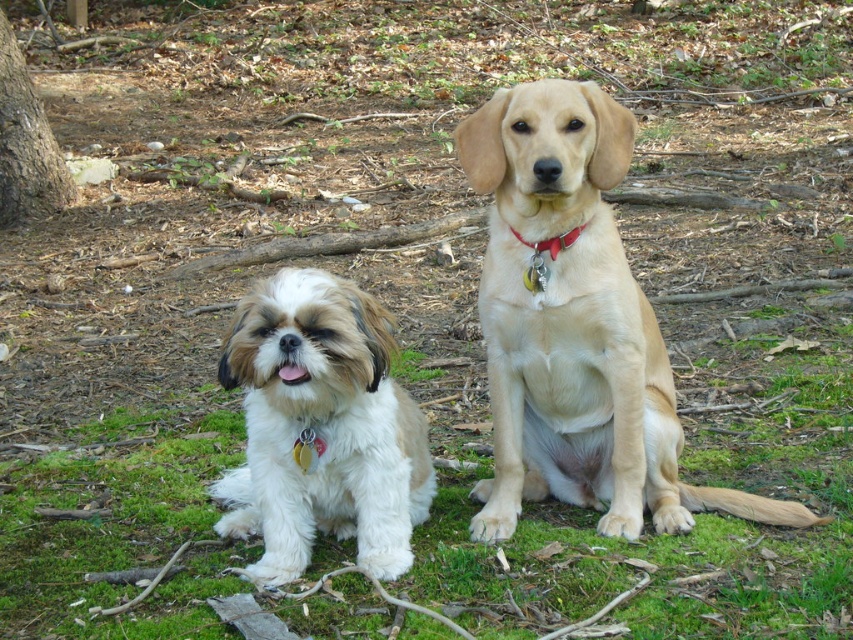
Which is more to the left, brown rough bark tree at left or red leather collar at center?

brown rough bark tree at left

In the scene shown: Is brown rough bark tree at left above red leather collar at center?

Yes.

Is point (32, 88) in front of point (544, 284)?

That is False.

Where is `brown rough bark tree at left`? This screenshot has width=853, height=640. brown rough bark tree at left is located at coordinates (26, 144).

Can you confirm if white fluffy dog at center is positioned below red leather collar at center?

Indeed, white fluffy dog at center is positioned under red leather collar at center.

Who is shorter, white fluffy dog at center or red leather collar at center?

red leather collar at center is shorter.

At what (x,y) coordinates should I click in order to perform the action: click on white fluffy dog at center. Please return your answer as a coordinate pair (x, y). Looking at the image, I should click on (321, 428).

Which of these two, green soft grass at center or light brown fur at center, stands shorter?

Standing shorter between the two is green soft grass at center.

Can you confirm if green soft grass at center is positioned to the right of light brown fur at center?

No, green soft grass at center is not to the right of light brown fur at center.

Is point (740, 598) in front of point (593, 333)?

Yes.

Where is `green soft grass at center`? The height and width of the screenshot is (640, 853). green soft grass at center is located at coordinates (647, 513).